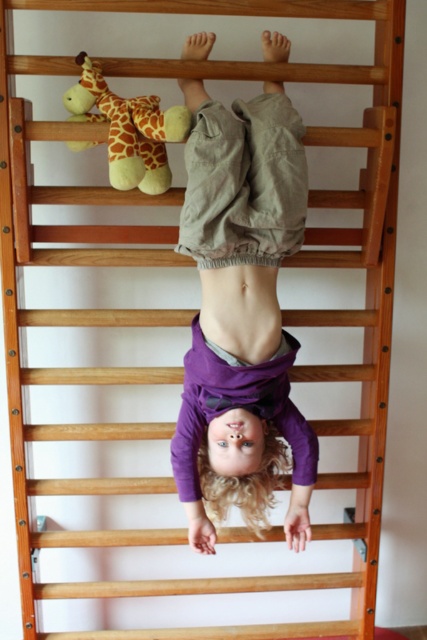
Is purple cotton shirt at center taller than soft plush giraffe at upper center?

Indeed, purple cotton shirt at center has a greater height compared to soft plush giraffe at upper center.

Between point (202, 141) and point (160, 109), which one is positioned in front?

Point (202, 141) is in front.

Where is `purple cotton shirt at center`? purple cotton shirt at center is located at coordinates (242, 308).